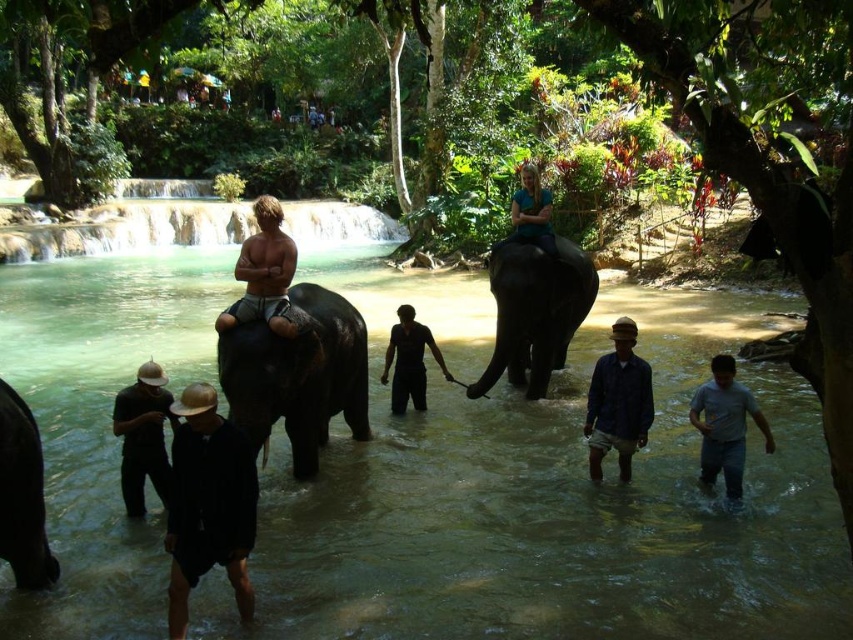
Question: Can you confirm if black matte helmet at lower left is thinner than gray cotton shirt at lower right?

Choices:
 (A) yes
 (B) no

Answer: (A)

Question: Which point is closer to the camera?

Choices:
 (A) clear blue water at center
 (B) black matte hat at center
 (C) dark gray elephant at lower left
 (D) black matte helmet at lower left

Answer: (B)

Question: Is black matte hat at center behind clear blue water at center?

Choices:
 (A) yes
 (B) no

Answer: (B)

Question: Which point is farther to the camera?

Choices:
 (A) (245, 342)
 (B) (607, 376)

Answer: (B)

Question: Which point is closer to the camera?

Choices:
 (A) gray cotton shirt at lower right
 (B) clear blue water at center
 (C) gray matte elephant at left
 (D) brown cotton shirt at lower center

Answer: (C)

Question: Observing the image, what is the correct spatial positioning of greenish-brown water at center in reference to gray matte elephant at left?

Choices:
 (A) below
 (B) above

Answer: (B)